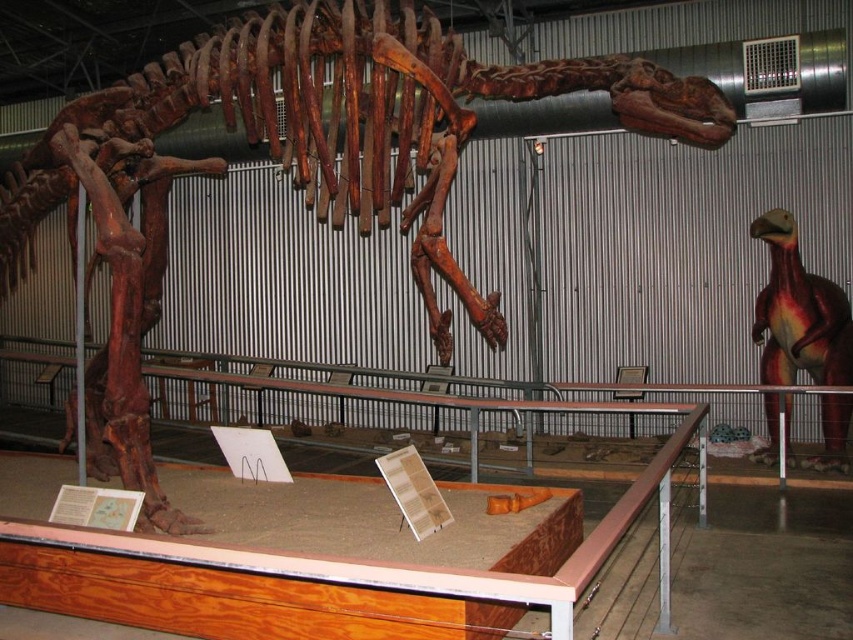
Who is positioned more to the right, wooden dinosaur skeleton at center or smooth red dinosaur at right?

From the viewer's perspective, smooth red dinosaur at right appears more on the right side.

Can you confirm if wooden dinosaur skeleton at center is bigger than smooth red dinosaur at right?

Yes, wooden dinosaur skeleton at center is bigger than smooth red dinosaur at right.

Which is behind, point (325, 35) or point (822, 280)?

Point (822, 280)

Find the location of a particular element. This screenshot has width=853, height=640. wooden dinosaur skeleton at center is located at coordinates (294, 168).